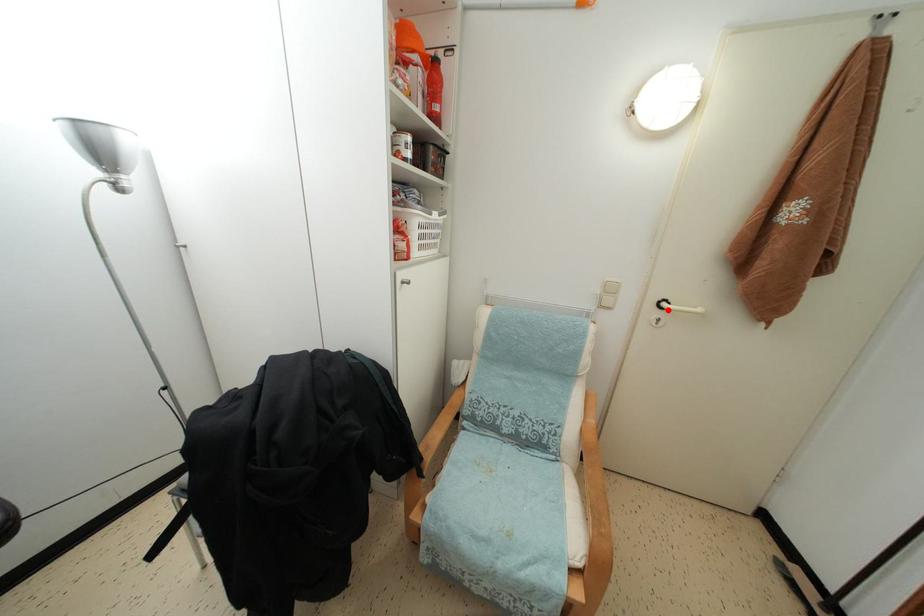
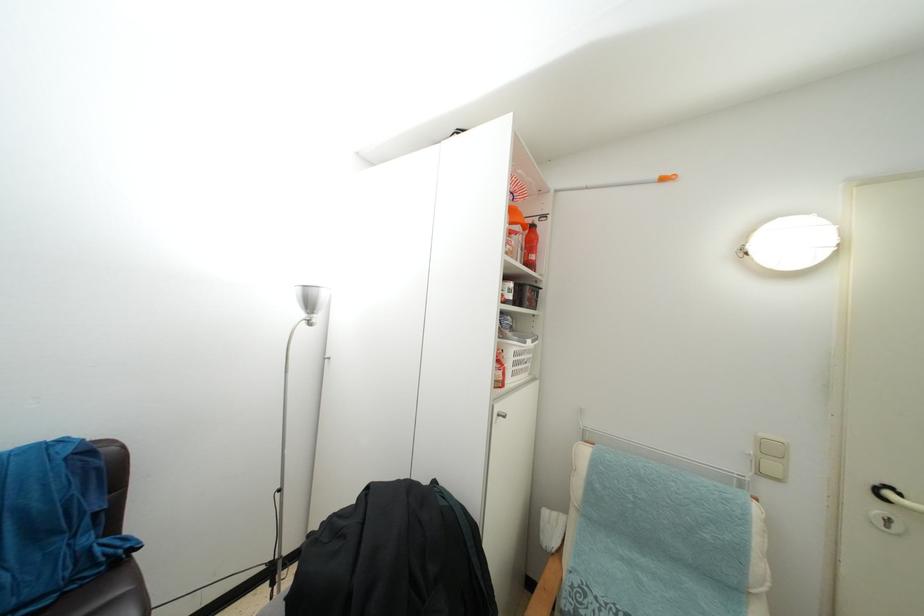
Where in the second image is the point corresponding to the highlighted location from the first image?

(893, 500)